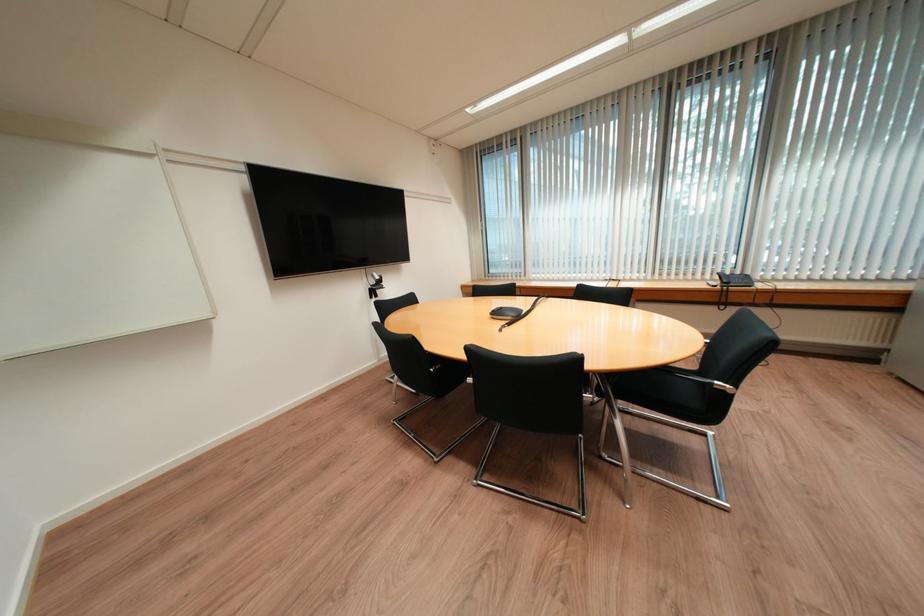
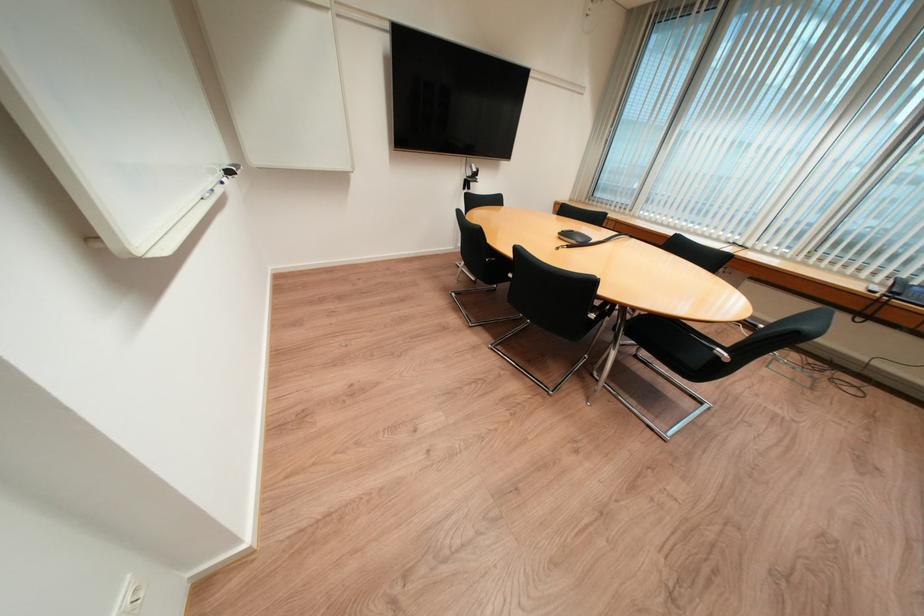
Where in the second image is the point corresponding to [379,291] from the first image?

(473, 182)